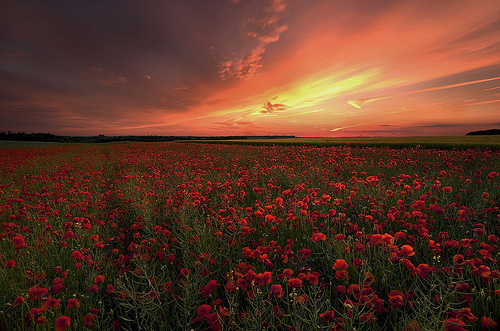
The height and width of the screenshot is (331, 500). What are the coordinates of `yellow light` in the screenshot? It's located at (318, 93).